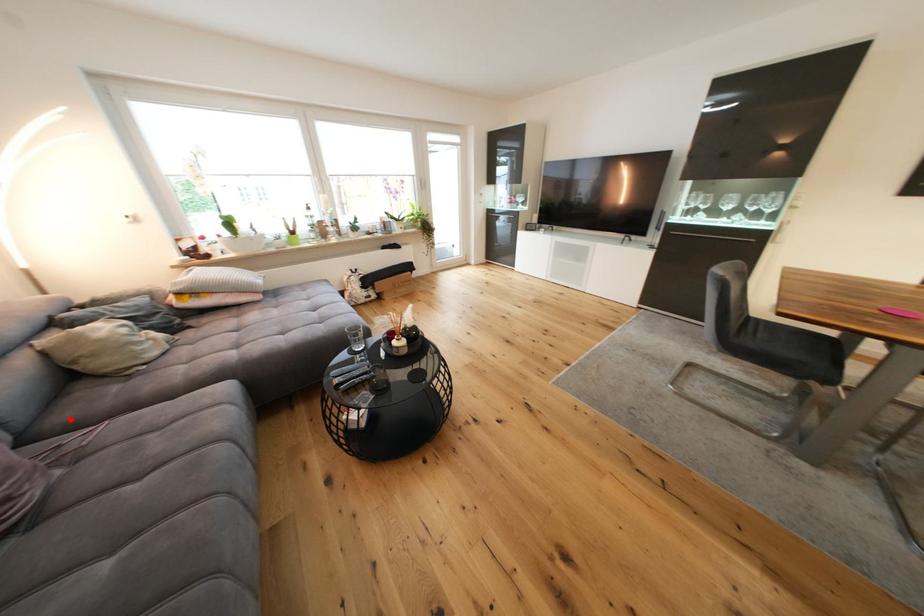
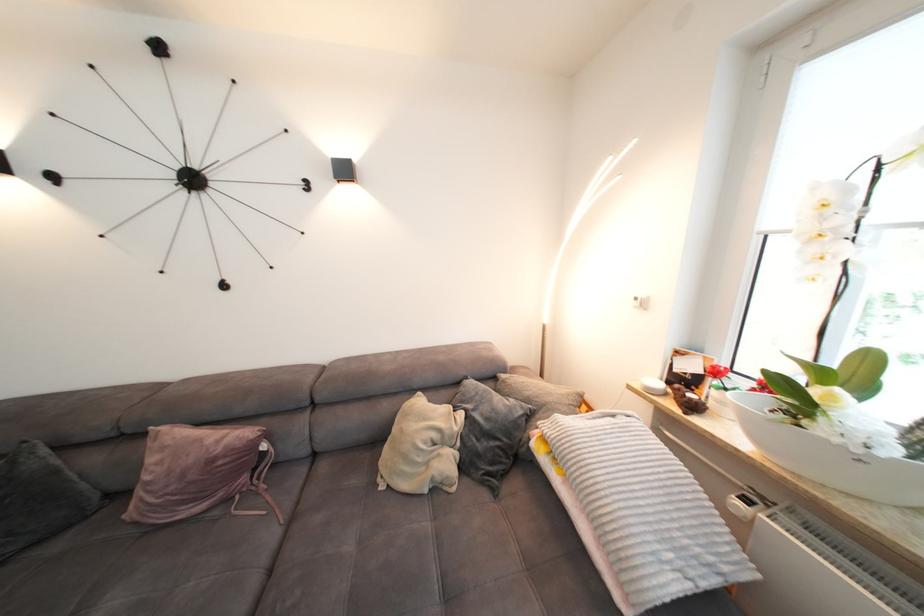
The point at the highlighted location is marked in the first image. Where is the corresponding point in the second image?

(330, 469)